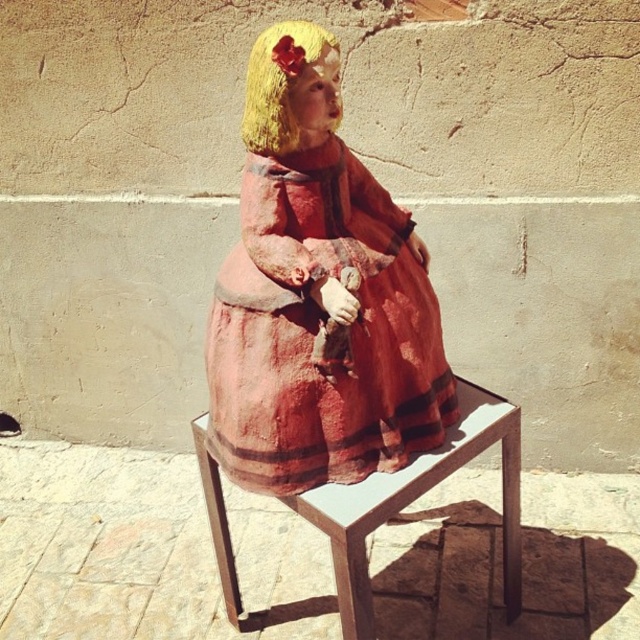
Question: Can you confirm if matte clay doll at center is bigger than matte red fabric dress at center?

Choices:
 (A) yes
 (B) no

Answer: (A)

Question: Can you confirm if matte clay doll at center is smaller than wooden stool at center?

Choices:
 (A) yes
 (B) no

Answer: (B)

Question: Estimate the real-world distances between objects in this image. Which object is farther from the matte red fabric dress at center?

Choices:
 (A) wooden stool at center
 (B) matte clay doll at center

Answer: (A)

Question: Which point is farther to the camera?

Choices:
 (A) matte red fabric dress at center
 (B) wooden stool at center
 (C) matte clay doll at center

Answer: (B)

Question: Considering the real-world distances, which object is farthest from the matte red fabric dress at center?

Choices:
 (A) matte clay doll at center
 (B) wooden stool at center

Answer: (B)

Question: Is matte clay doll at center smaller than matte red fabric dress at center?

Choices:
 (A) no
 (B) yes

Answer: (A)